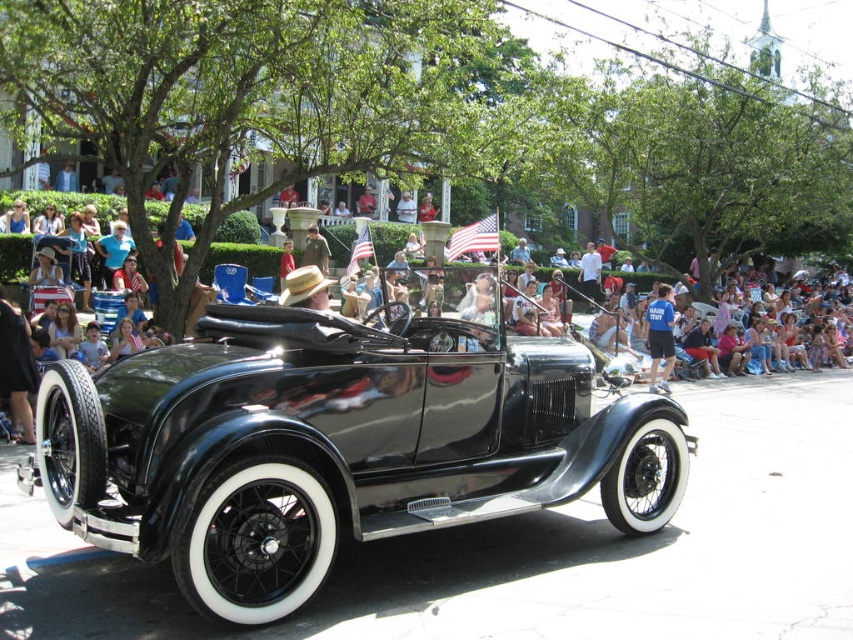
Does matte black car at center lie behind blue cotton shirt at center?

Result: No, matte black car at center is in front of blue cotton shirt at center.

Which is behind, point (305, 211) or point (654, 387)?

Point (305, 211)

Is point (1, 209) closer to camera compared to point (664, 285)?

No, (1, 209) is behind (664, 285).

Identify the location of matte black car at center. pyautogui.click(x=54, y=202).

Which is above, shiny black car at center or blue cotton shirt at center?

shiny black car at center is higher up.

Who is positioned more to the right, shiny black car at center or blue cotton shirt at center?

Positioned to the right is blue cotton shirt at center.

At what (x,y) coordinates should I click in order to perform the action: click on shiny black car at center. Please return your answer as a coordinate pair (x, y). This screenshot has height=640, width=853. Looking at the image, I should click on point(339,438).

Which is above, shiny black car at center or matte black car at center?

matte black car at center

Is point (77, 390) positioned behind point (244, 224)?

No, (77, 390) is in front of (244, 224).

Find the location of a particular element. The height and width of the screenshot is (640, 853). shiny black car at center is located at coordinates [339, 438].